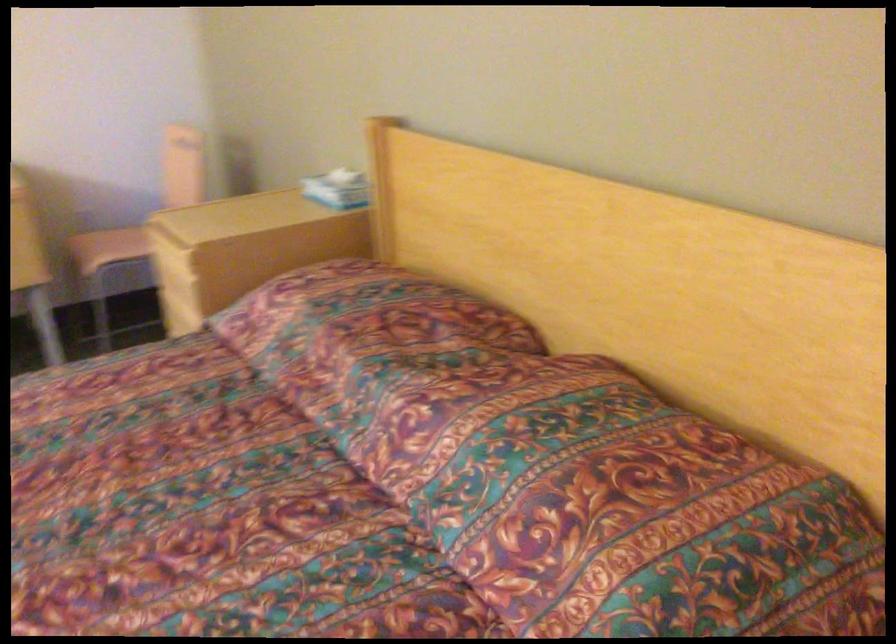
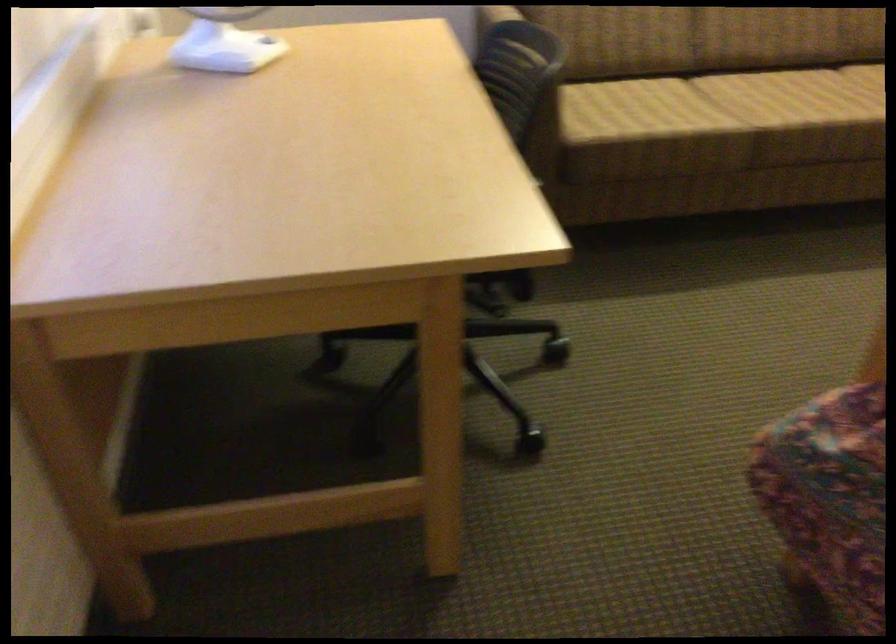
The images are taken continuously from a first-person perspective. In which direction is your viewpoint rotating?

The camera's rotation is toward left-down.